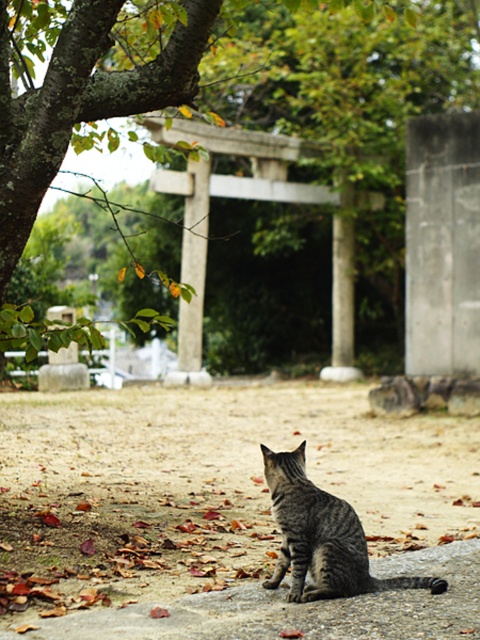
You are standing in the outdoor scene and want to walk from point (417, 125) to point (349, 506). Which direction should you move relative to your current position?

You should move away from the viewer since point (417, 125) is closer to you than point (349, 506).

You are standing at the center of the image and want to walk towards the point marked as point (442,244). Which direction should you move to reach the smooth concrete stone at center right?

You should move to the right to reach the smooth concrete stone at center right because the point is marked at center right.

You are a photographer aiming to capture the gray striped cat at lower center and the smooth concrete stone at center right in the same frame. Based on their positions, which object is located to the right of the other?

The smooth concrete stone at center right is to the right of the gray striped cat at lower center.